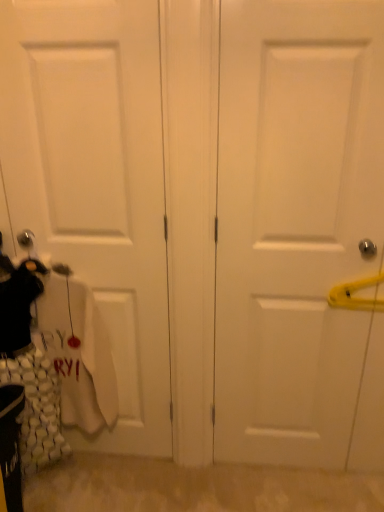
Question: Considering the relative sizes of white matte door at right, which is the 1th door from right to left, and white matte door at left, placed as the 2th door when sorted from right to left, in the image provided, is white matte door at right, which is the 1th door from right to left, bigger than white matte door at left, placed as the 2th door when sorted from right to left,?

Choices:
 (A) yes
 (B) no

Answer: (A)

Question: Is white matte door at right, marked as the second door in a left-to-right arrangement, positioned far away from white matte door at left, the first door in the left-to-right sequence?

Choices:
 (A) yes
 (B) no

Answer: (B)

Question: Considering the relative positions of white matte door at right, which is the 1th door from right to left, and white matte door at left, the first door in the left-to-right sequence, in the image provided, is white matte door at right, which is the 1th door from right to left, to the right of white matte door at left, the first door in the left-to-right sequence, from the viewer's perspective?

Choices:
 (A) yes
 (B) no

Answer: (A)

Question: Considering the relative positions of white matte door at right, which is the 1th door from right to left, and white matte door at left, the first door in the left-to-right sequence, in the image provided, is white matte door at right, which is the 1th door from right to left, to the left of white matte door at left, the first door in the left-to-right sequence, from the viewer's perspective?

Choices:
 (A) no
 (B) yes

Answer: (A)

Question: Is white matte door at right, which is the 1th door from right to left, further to camera compared to white matte door at left, the first door in the left-to-right sequence?

Choices:
 (A) no
 (B) yes

Answer: (A)

Question: From a real-world perspective, is white matte door at right, marked as the second door in a left-to-right arrangement, positioned under white matte door at left, the first door in the left-to-right sequence, based on gravity?

Choices:
 (A) no
 (B) yes

Answer: (B)

Question: Considering the relative sizes of white matte door at left, placed as the 2th door when sorted from right to left, and white matte door at right, which is the 1th door from right to left, in the image provided, is white matte door at left, placed as the 2th door when sorted from right to left, shorter than white matte door at right, which is the 1th door from right to left,?

Choices:
 (A) yes
 (B) no

Answer: (B)

Question: From the image's perspective, is white matte door at left, the first door in the left-to-right sequence, below white matte door at right, which is the 1th door from right to left?

Choices:
 (A) yes
 (B) no

Answer: (B)

Question: Considering the relative sizes of white matte door at left, the first door in the left-to-right sequence, and white matte door at right, which is the 1th door from right to left, in the image provided, is white matte door at left, the first door in the left-to-right sequence, bigger than white matte door at right, which is the 1th door from right to left,?

Choices:
 (A) yes
 (B) no

Answer: (B)

Question: Are white matte door at left, placed as the 2th door when sorted from right to left, and white matte door at right, which is the 1th door from right to left, far apart?

Choices:
 (A) yes
 (B) no

Answer: (B)

Question: Does white matte door at left, placed as the 2th door when sorted from right to left, appear on the left side of white matte door at right, which is the 1th door from right to left?

Choices:
 (A) no
 (B) yes

Answer: (B)

Question: From a real-world perspective, is white matte door at left, placed as the 2th door when sorted from right to left, on white matte door at right, which is the 1th door from right to left?

Choices:
 (A) no
 (B) yes

Answer: (B)

Question: Considering the positions of white matte door at left, placed as the 2th door when sorted from right to left, and white matte door at right, which is the 1th door from right to left, in the image, is white matte door at left, placed as the 2th door when sorted from right to left, taller or shorter than white matte door at right, which is the 1th door from right to left,?

Choices:
 (A) short
 (B) tall

Answer: (B)